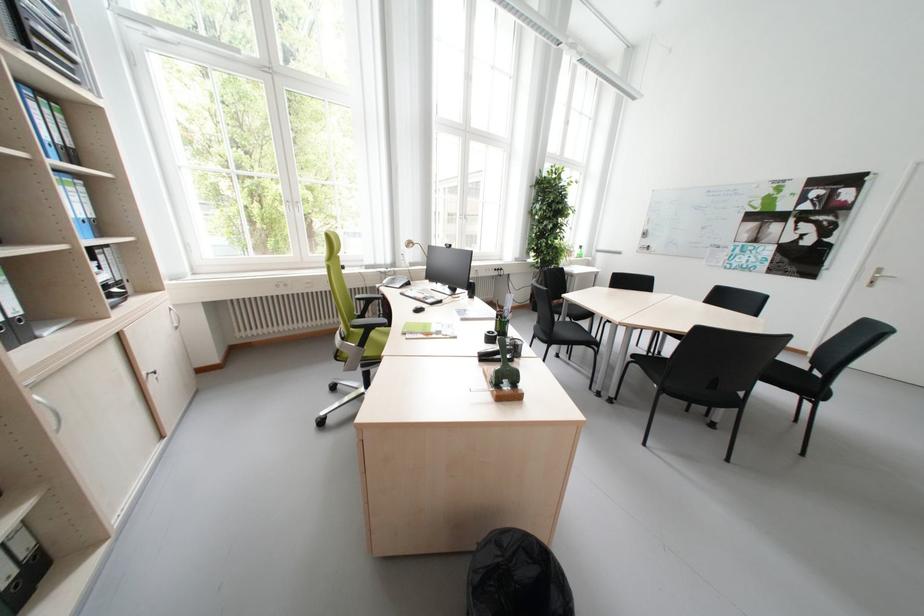
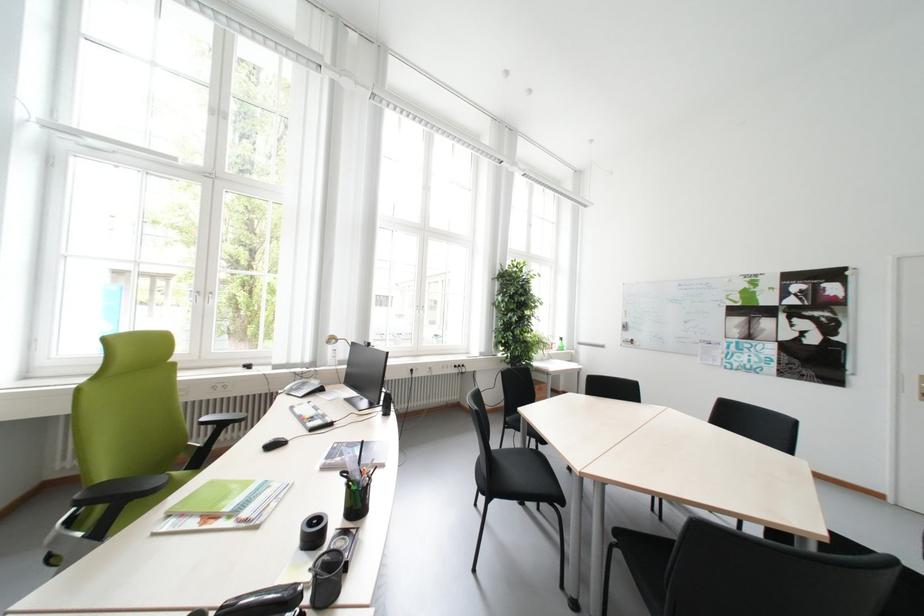
Where in the second image is the point corresponding to [558,337] from the first image?

(502, 480)